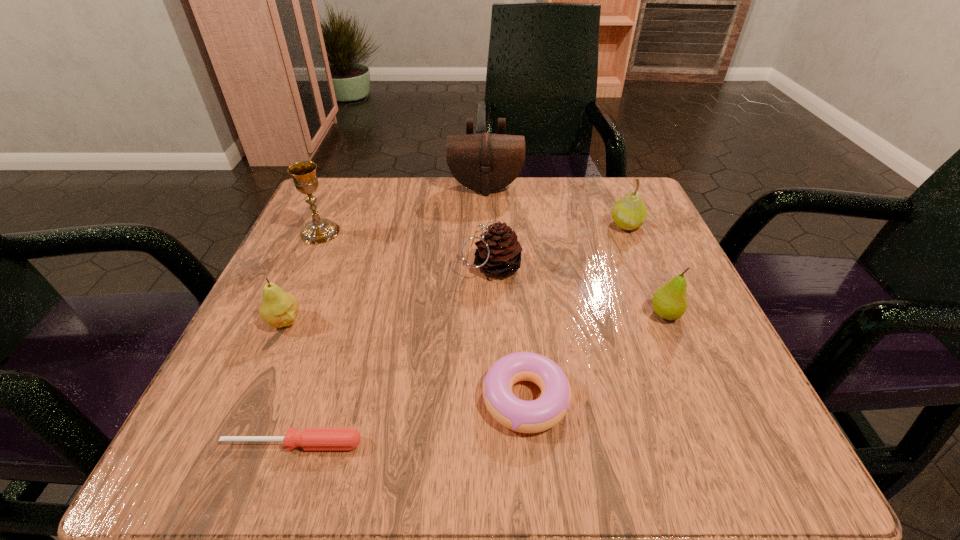
Image resolution: width=960 pixels, height=540 pixels. Find the location of `screwdriver that is at the near edge`. screwdriver that is at the near edge is located at coordinates (311, 438).

At what (x,y) coordinates should I click in order to perform the action: click on chalice that is at the left edge. Please return your answer as a coordinate pair (x, y). Looking at the image, I should click on (319, 230).

Image resolution: width=960 pixels, height=540 pixels. Find the location of `pear that is at the left edge`. pear that is at the left edge is located at coordinates (278, 308).

Where is `screwdriver that is at the left edge`? This screenshot has height=540, width=960. screwdriver that is at the left edge is located at coordinates (311, 438).

Identify the location of object that is positioned at the far left corner. (319, 230).

This screenshot has width=960, height=540. In order to click on object positioned at the near left corner in this screenshot , I will do `click(311, 438)`.

The width and height of the screenshot is (960, 540). Find the location of `object that is at the far right corner`. object that is at the far right corner is located at coordinates (629, 213).

In the image, there is a desktop. Where is `vacant area at the far edge`? Image resolution: width=960 pixels, height=540 pixels. vacant area at the far edge is located at coordinates (398, 183).

The height and width of the screenshot is (540, 960). In order to click on vacant space at the left edge in this screenshot , I will do `click(290, 284)`.

This screenshot has width=960, height=540. In the image, there is a desktop. What are the coordinates of `vacant space at the right edge` in the screenshot? It's located at (647, 397).